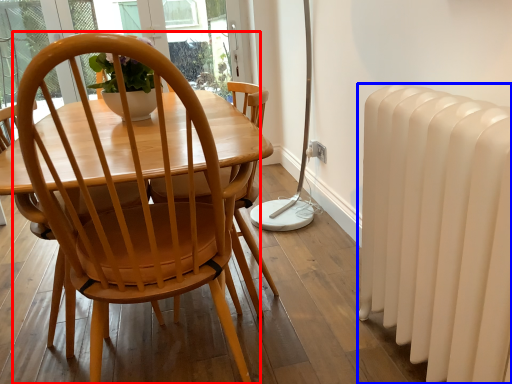
Question: Which point is closer to the camera, chair (highlighted by a red box) or radiator (highlighted by a blue box)?

Choices:
 (A) chair
 (B) radiator

Answer: (A)